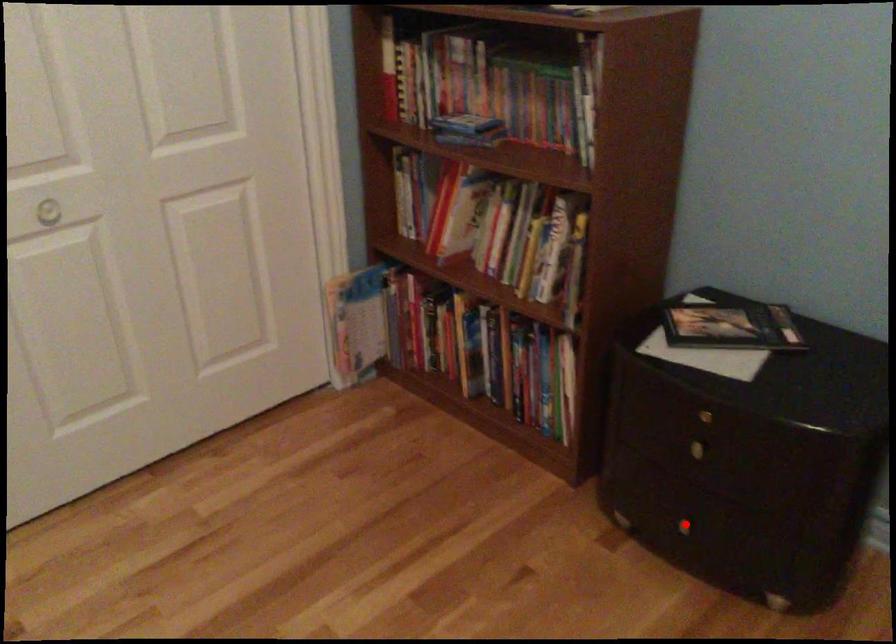
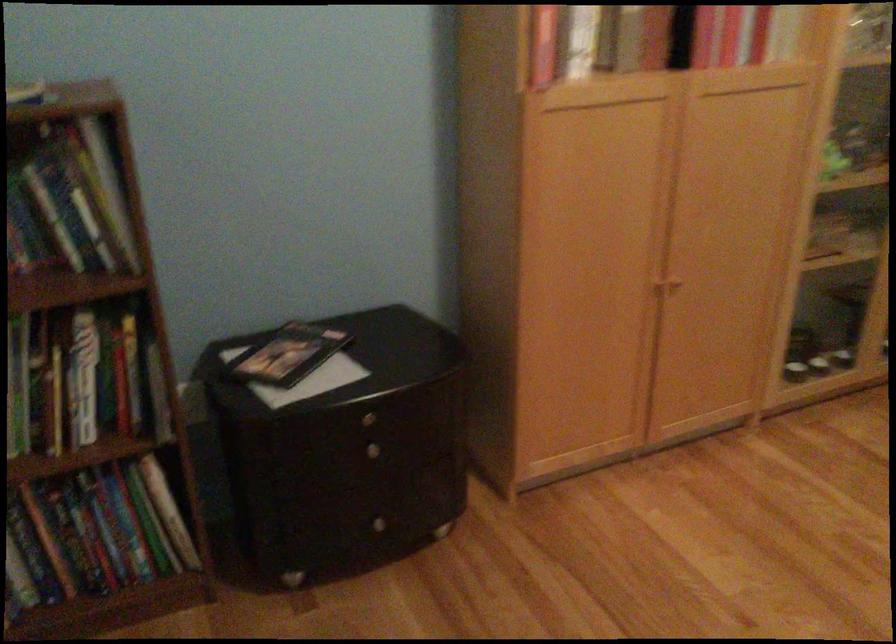
Question: I am providing you with two images of the same scene from different viewpoints. A red point is marked on the first image. Can you still see the location of the red point in image 2?

Choices:
 (A) Yes
 (B) No

Answer: (A)